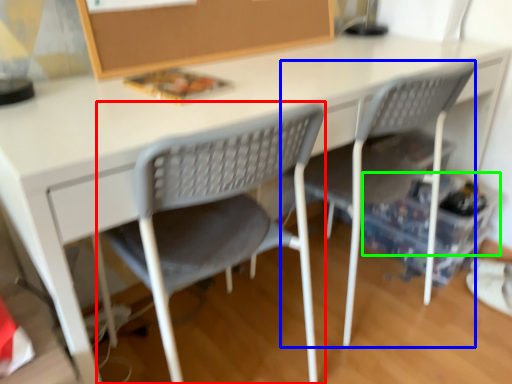
Question: Considering the real-world distances, which object is farthest from chair (highlighted by a red box)? chair (highlighted by a blue box) or storage box (highlighted by a green box)?

Choices:
 (A) chair
 (B) storage box

Answer: (B)